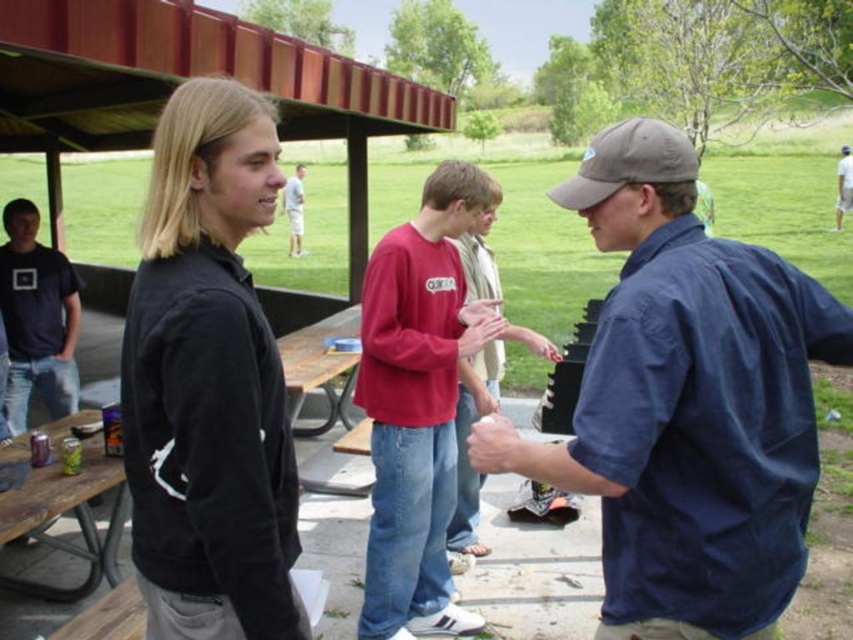
Question: Can you confirm if black fleece jacket at left is wider than blue denim jeans at center?

Choices:
 (A) no
 (B) yes

Answer: (A)

Question: Is dark blue t-shirt at left positioned at the back of red shirt at center?

Choices:
 (A) yes
 (B) no

Answer: (B)

Question: Can you confirm if matte red shirt at center is bigger than blue denim jeans at center?

Choices:
 (A) no
 (B) yes

Answer: (B)

Question: Which object appears closest to the camera in this image?

Choices:
 (A) red shirt at center
 (B) black fleece jacket at left
 (C) matte red shirt at center
 (D) gray fabric baseball cap at center-right

Answer: (B)

Question: Which object appears closest to the camera in this image?

Choices:
 (A) red shirt at center
 (B) matte red shirt at center
 (C) black fleece jacket at left
 (D) dark blue t-shirt at left

Answer: (C)

Question: Among these objects, which one is nearest to the camera?

Choices:
 (A) matte red shirt at center
 (B) red shirt at center

Answer: (A)